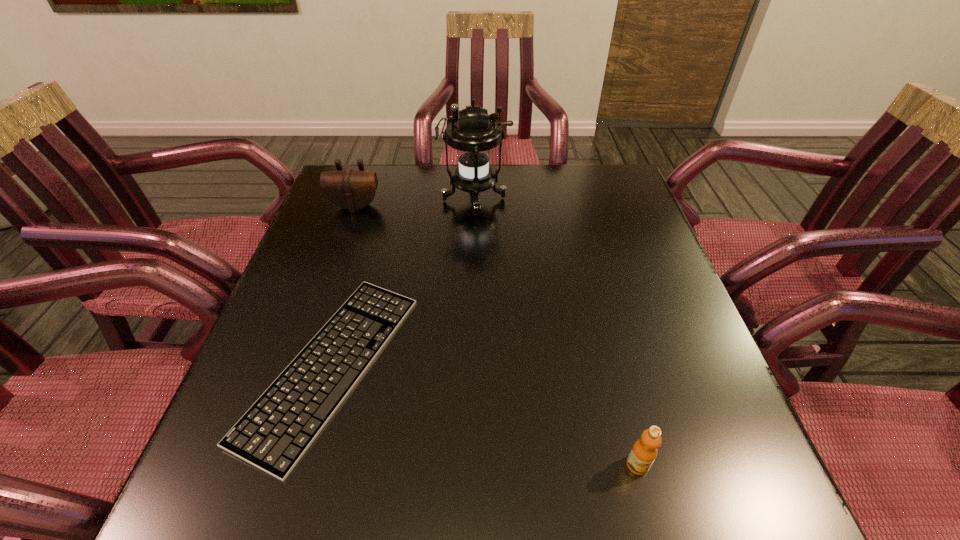
Identify the location of free space between the rightmost object and the lantern. The height and width of the screenshot is (540, 960). (556, 332).

You are a GUI agent. You are given a task and a screenshot of the screen. Output one action in this format:
    pyautogui.click(x=<x>, y=<y>)
    Task: Click on the free space between the pouch and the shortest object
    
    Given the screenshot: What is the action you would take?
    pyautogui.click(x=344, y=286)

The height and width of the screenshot is (540, 960). I want to click on free space between the orange juice and the pouch, so click(x=496, y=335).

You are a GUI agent. You are given a task and a screenshot of the screen. Output one action in this format:
    pyautogui.click(x=<x>, y=<y>)
    Task: Click on the object that stands as the third closest to the shortest object
    
    Given the screenshot: What is the action you would take?
    pyautogui.click(x=644, y=451)

Select which object is the third closest to the tallest object. Please provide its 2D coordinates. Your answer should be formatted as a tuple, i.e. [(x, y)], where the tuple contains the x and y coordinates of a point satisfying the conditions above.

[(644, 451)]

This screenshot has height=540, width=960. What are the coordinates of `free space that satisfies the following two spatial constraints: 1. with the flap open on the computer keyboard; 2. on the left side of the pouch` in the screenshot? It's located at (300, 366).